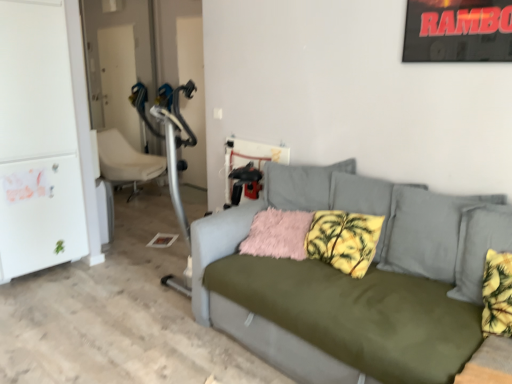
Question: Considering the relative positions of white plastic chair at left and fuzzy pink pillow at center, which is the 1th pillow in left-to-right order, in the image provided, is white plastic chair at left to the left of fuzzy pink pillow at center, which is the 1th pillow in left-to-right order, from the viewer's perspective?

Choices:
 (A) no
 (B) yes

Answer: (B)

Question: Can you confirm if white plastic chair at left is wider than fuzzy pink pillow at center, the second pillow when ordered from right to left?

Choices:
 (A) yes
 (B) no

Answer: (A)

Question: Is the position of white plastic chair at left less distant than that of fuzzy pink pillow at center, which is the 1th pillow in left-to-right order?

Choices:
 (A) no
 (B) yes

Answer: (A)

Question: Is white plastic chair at left shorter than fuzzy pink pillow at center, the second pillow when ordered from right to left?

Choices:
 (A) no
 (B) yes

Answer: (A)

Question: Can you confirm if white plastic chair at left is taller than fuzzy pink pillow at center, which is the 1th pillow in left-to-right order?

Choices:
 (A) no
 (B) yes

Answer: (B)

Question: Is point (444, 218) positioned closer to the camera than point (285, 218)?

Choices:
 (A) farther
 (B) closer

Answer: (B)

Question: Would you say olive green fabric couch at center is inside or outside fuzzy pink pillow at center, which is the 1th pillow in left-to-right order?

Choices:
 (A) outside
 (B) inside

Answer: (A)

Question: Is olive green fabric couch at center taller or shorter than fuzzy pink pillow at center, which is the 1th pillow in left-to-right order?

Choices:
 (A) tall
 (B) short

Answer: (A)

Question: Considering their positions, is olive green fabric couch at center located in front of or behind fuzzy pink pillow at center, the second pillow when ordered from right to left?

Choices:
 (A) behind
 (B) front

Answer: (B)

Question: Which is correct: white matte refrigerator at left is inside white plastic chair at left, or outside of it?

Choices:
 (A) inside
 (B) outside

Answer: (B)

Question: Considering the positions of white matte refrigerator at left and white plastic chair at left in the image, is white matte refrigerator at left bigger or smaller than white plastic chair at left?

Choices:
 (A) big
 (B) small

Answer: (A)

Question: From the image's perspective, is white matte refrigerator at left located above or below white plastic chair at left?

Choices:
 (A) below
 (B) above

Answer: (B)

Question: From a real-world perspective, is white matte refrigerator at left above or below white plastic chair at left?

Choices:
 (A) below
 (B) above

Answer: (B)

Question: Looking at their shapes, would you say white plastic chair at left is wider or thinner than fuzzy pink pillow at center, which is the 1th pillow in left-to-right order?

Choices:
 (A) wide
 (B) thin

Answer: (A)

Question: Is white plastic chair at left to the left or to the right of fuzzy pink pillow at center, the second pillow when ordered from right to left, in the image?

Choices:
 (A) right
 (B) left

Answer: (B)